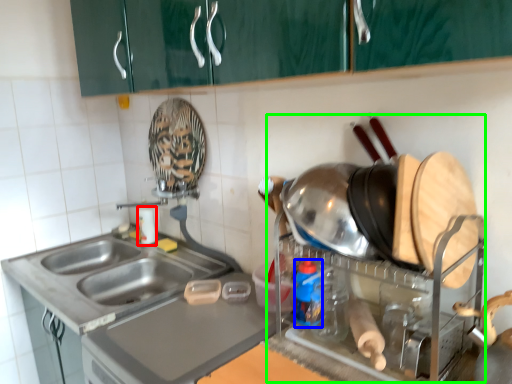
Question: Which object is positioned closest to bottle (highlighted by a red box)? Select from bottle (highlighted by a blue box) and appliance (highlighted by a green box).

Choices:
 (A) bottle
 (B) appliance

Answer: (A)